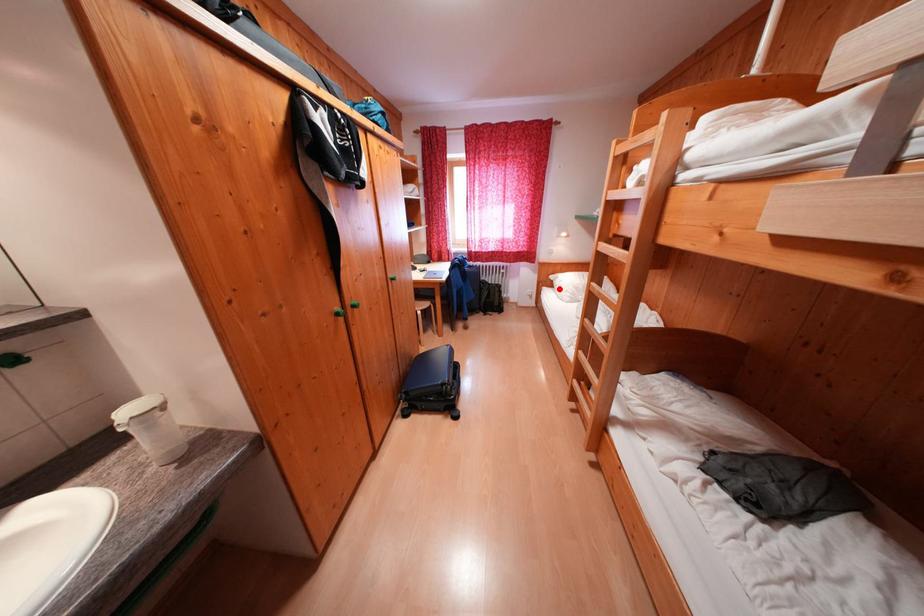
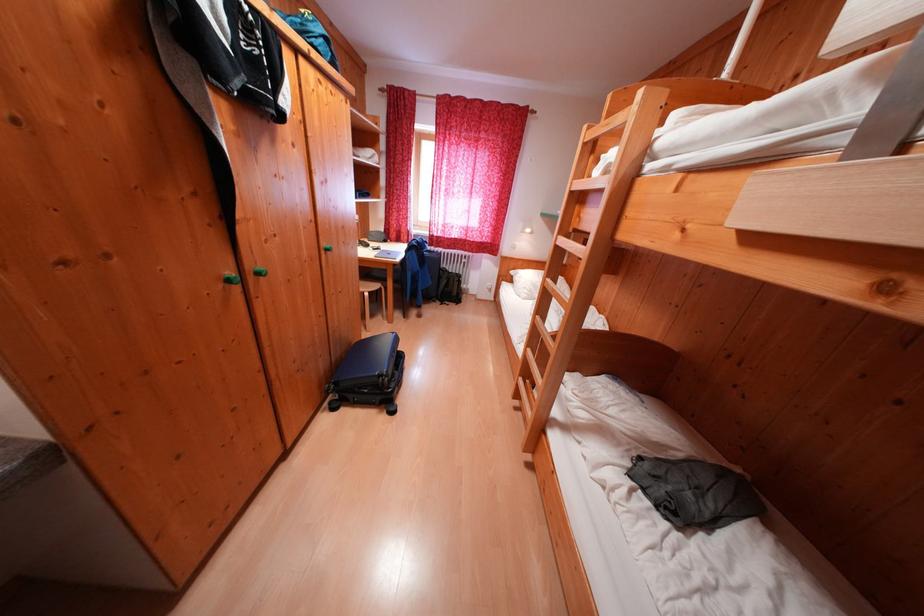
In the second image, find the point that corresponds to the highlighted location in the first image.

(518, 284)